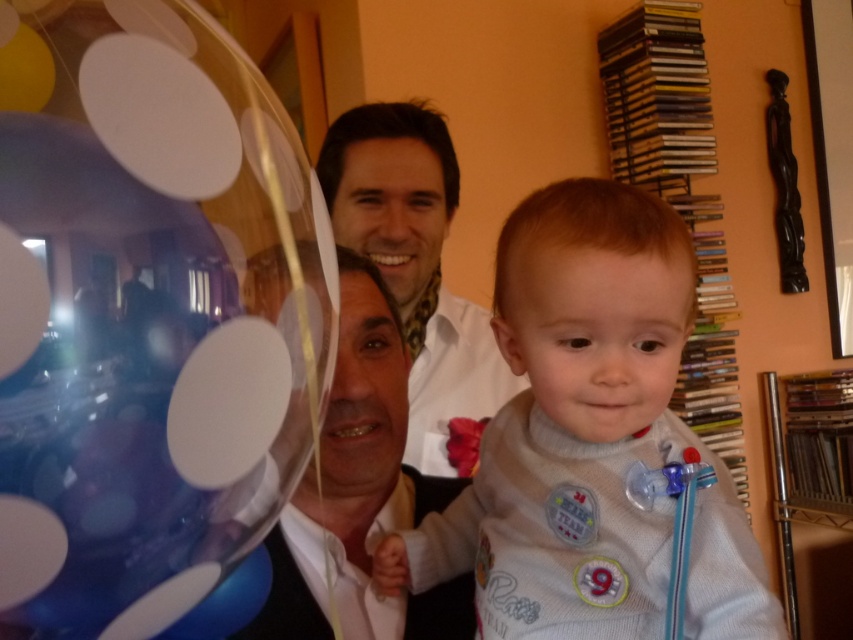
You are a photographer taking a picture of the white soft baby at center and the matte black shirt at center. Which object should you focus on first if you want to capture both in the same frame without moving the camera?

The white soft baby at center has a lesser height compared to matte black shirt at center, so you should focus on the white soft baby at center first to ensure both are in the frame.

You are holding a small toy drone that can fly up to 8 inches. You want to fly it from your current position to take a photo of the transparent plastic balloon at upper left. Is the distance within the drone

The transparent plastic balloon at upper left is 9.21 inches from camera, which is beyond the drone